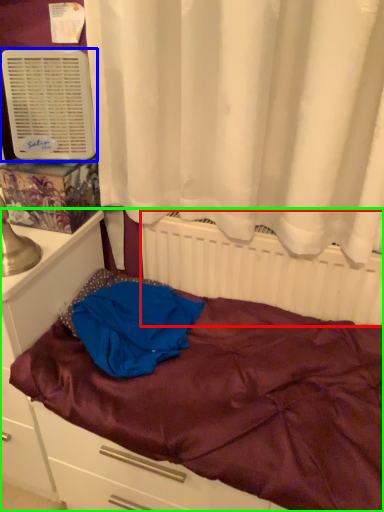
Question: Which object is positioned farthest from radiator (highlighted by a red box)? Select from air conditioning (highlighted by a blue box) and bed (highlighted by a green box).

Choices:
 (A) air conditioning
 (B) bed

Answer: (A)